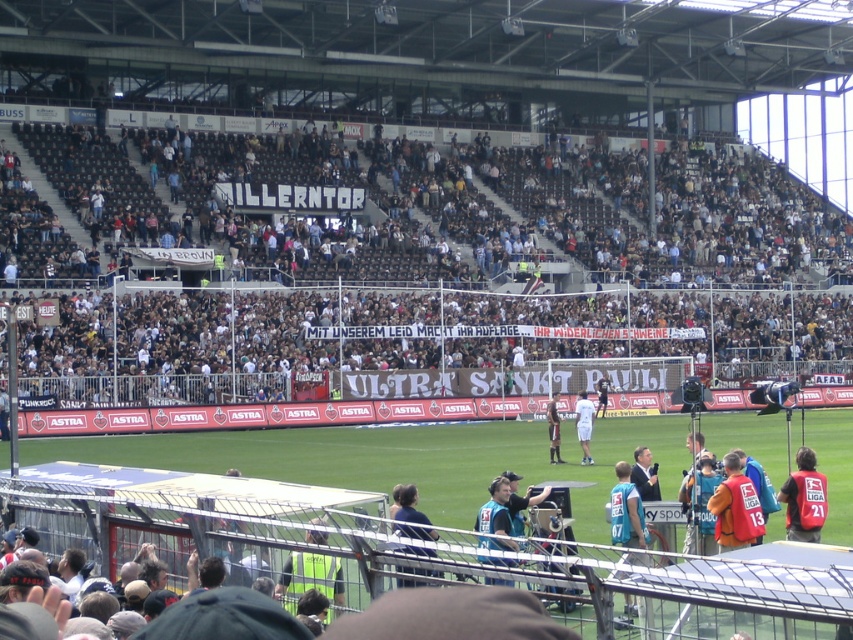
Question: Estimate the real-world distances between objects in this image. Which object is closer to the dark brown leather jacket at center?

Choices:
 (A) dark blue shirt at center
 (B) white fabric banner at upper center
 (C) red fabric vest at lower right
 (D) orange jersey at right

Answer: (B)

Question: Does red fabric vest at lower right have a smaller size compared to dark blue shirt at center?

Choices:
 (A) yes
 (B) no

Answer: (B)

Question: Can you confirm if white fabric banner at upper center is wider than dark blue shirt at center?

Choices:
 (A) yes
 (B) no

Answer: (A)

Question: Is dark brown leather jacket at center bigger than dark blue jersey at center?

Choices:
 (A) yes
 (B) no

Answer: (A)

Question: Which point is farther to the camera?

Choices:
 (A) (735, 460)
 (B) (798, 493)
 (C) (553, 413)

Answer: (C)

Question: Which of the following is the closest to the observer?

Choices:
 (A) orange jersey at right
 (B) dark brown leather jacket at center
 (C) red fabric vest at lower right
 (D) dark blue jersey at center

Answer: (C)